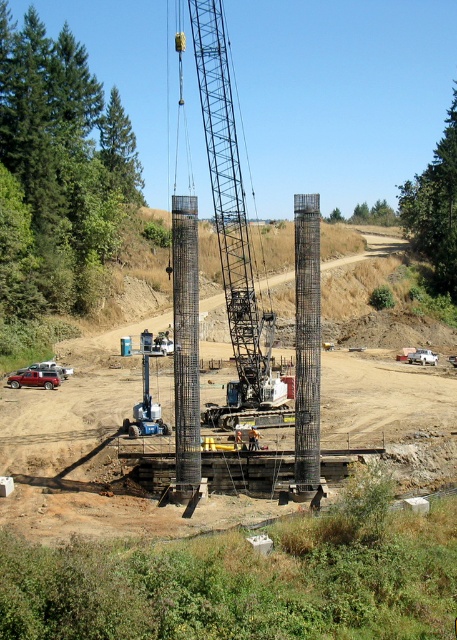
Question: Which object appears farthest from the camera in this image?

Choices:
 (A) metallic red suv at lower left
 (B) metallic gray crane at center
 (C) gray metallic rebar column at center

Answer: (A)

Question: Which of the following is the closest to the observer?

Choices:
 (A) (74, 426)
 (B) (318, 452)
 (C) (203, 1)
 (D) (249, 448)

Answer: (B)

Question: Is metallic gray crane at center thinner than gray metallic rebar column at center?

Choices:
 (A) yes
 (B) no

Answer: (B)

Question: Does smooth concrete pillars at center lie in front of gray metallic rebar column at center?

Choices:
 (A) no
 (B) yes

Answer: (B)

Question: Which of the following is the closest to the observer?

Choices:
 (A) (377, 243)
 (B) (246, 275)

Answer: (B)

Question: Can you confirm if smooth concrete pillars at center is thinner than gray metallic rebar column at center?

Choices:
 (A) no
 (B) yes

Answer: (A)